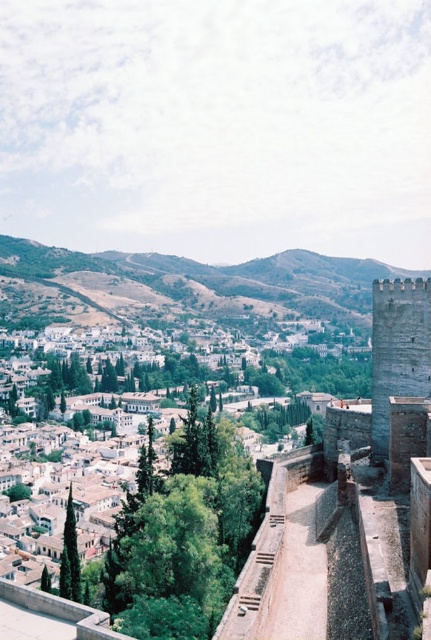
Question: Is the position of white stone town at center less distant than that of green grassy hillside at center?

Choices:
 (A) yes
 (B) no

Answer: (A)

Question: Which object is the closest to the white stone town at center?

Choices:
 (A) green grassy hillside at center
 (B) gray stone tower at right

Answer: (B)

Question: Can you confirm if white stone town at center is positioned to the right of green grassy hillside at center?

Choices:
 (A) yes
 (B) no

Answer: (B)

Question: Does white stone town at center appear on the right side of green grassy hillside at center?

Choices:
 (A) no
 (B) yes

Answer: (A)

Question: Which point appears closest to the camera in this image?

Choices:
 (A) (243, 442)
 (B) (393, 298)

Answer: (B)

Question: Which of the following is the closest to the observer?

Choices:
 (A) green grassy hillside at center
 (B) white stone town at center

Answer: (B)